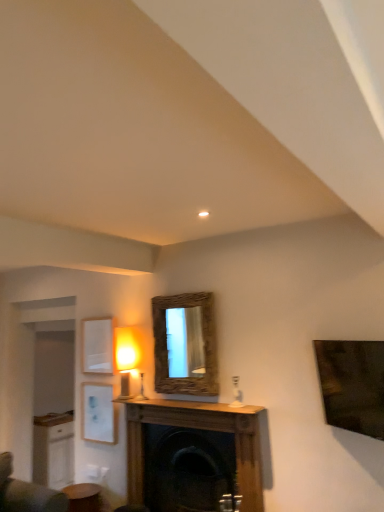
Question: Can you confirm if wooden fireplace at center is wider than white matte picture frame at lower left, the 2th picture frame in the top-to-bottom sequence?

Choices:
 (A) yes
 (B) no

Answer: (A)

Question: Is wooden fireplace at center facing towards white matte picture frame at lower left, the 2th picture frame in the top-to-bottom sequence?

Choices:
 (A) no
 (B) yes

Answer: (A)

Question: Considering the relative sizes of wooden fireplace at center and white matte picture frame at lower left, the 2th picture frame in the top-to-bottom sequence, in the image provided, is wooden fireplace at center thinner than white matte picture frame at lower left, the 2th picture frame in the top-to-bottom sequence,?

Choices:
 (A) no
 (B) yes

Answer: (A)

Question: From the image's perspective, is wooden fireplace at center beneath white matte picture frame at lower left, the 2th picture frame in the top-to-bottom sequence?

Choices:
 (A) no
 (B) yes

Answer: (B)

Question: Can you confirm if wooden fireplace at center is smaller than white matte picture frame at lower left, the 2th picture frame in the top-to-bottom sequence?

Choices:
 (A) no
 (B) yes

Answer: (A)

Question: From a real-world perspective, is wooden fireplace at center beneath white matte picture frame at lower left, the first picture frame in the bottom-to-top sequence?

Choices:
 (A) yes
 (B) no

Answer: (A)

Question: Is matte white table lamp at upper left, the 2th table lamp viewed from the right, located outside matte white glass at center, which is counted as the second table lamp, starting from the left?

Choices:
 (A) yes
 (B) no

Answer: (A)

Question: Does matte white table lamp at upper left, the 2th table lamp viewed from the right, have a lesser width compared to matte white glass at center, which is counted as the second table lamp, starting from the left?

Choices:
 (A) yes
 (B) no

Answer: (B)

Question: From the image's perspective, is matte white table lamp at upper left, which is counted as the 1th table lamp, starting from the left, located above matte white glass at center, which is counted as the second table lamp, starting from the left?

Choices:
 (A) no
 (B) yes

Answer: (B)

Question: Does matte white table lamp at upper left, which is counted as the 1th table lamp, starting from the left, have a greater width compared to matte white glass at center, which is counted as the second table lamp, starting from the left?

Choices:
 (A) no
 (B) yes

Answer: (B)

Question: Is matte white table lamp at upper left, the 2th table lamp viewed from the right, at the right side of matte white glass at center, acting as the 1th table lamp starting from the right?

Choices:
 (A) no
 (B) yes

Answer: (A)

Question: Is matte white table lamp at upper left, which is counted as the 1th table lamp, starting from the left, smaller than matte white glass at center, which is counted as the second table lamp, starting from the left?

Choices:
 (A) yes
 (B) no

Answer: (B)

Question: Is wooden fireplace at center surrounded by white matte picture frame at upper left, which appears as the second picture frame when ordered from the bottom?

Choices:
 (A) no
 (B) yes

Answer: (A)